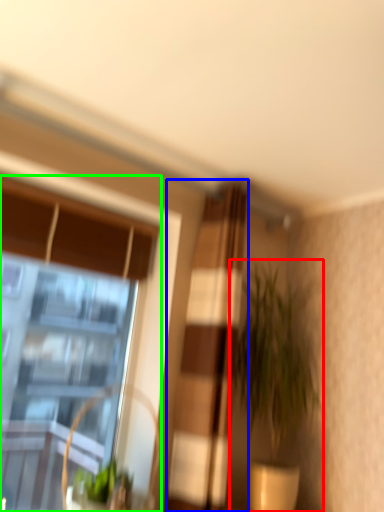
Question: Considering the real-world distances, which object is farthest from houseplant (highlighted by a red box)? curtain (highlighted by a blue box) or window (highlighted by a green box)?

Choices:
 (A) curtain
 (B) window

Answer: (B)